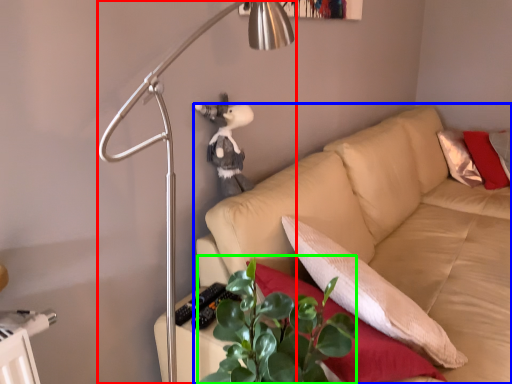
Question: Estimate the real-world distances between objects in this image. Which object is closer to lamp (highlighted by a red box), studio couch (highlighted by a blue box) or plant (highlighted by a green box)?

Choices:
 (A) studio couch
 (B) plant

Answer: (B)